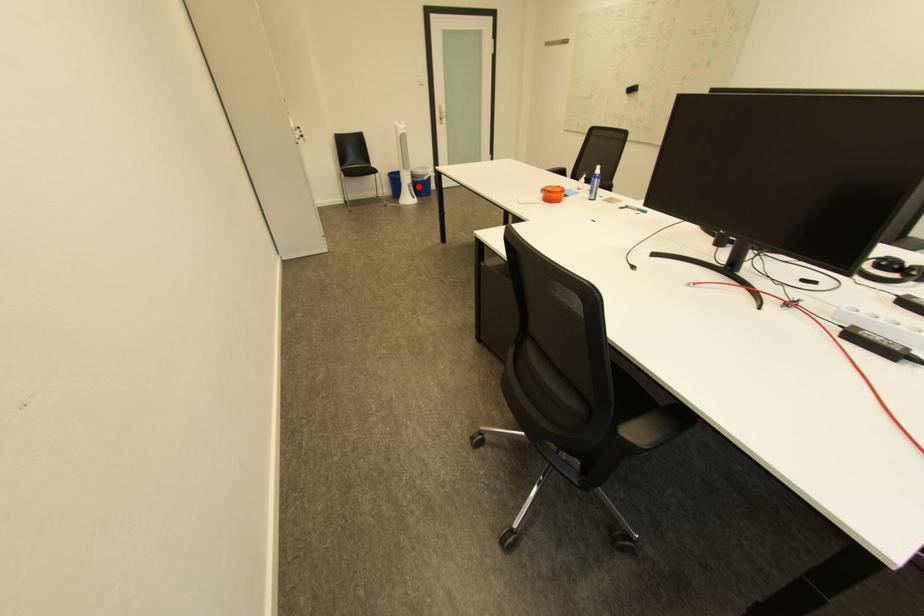
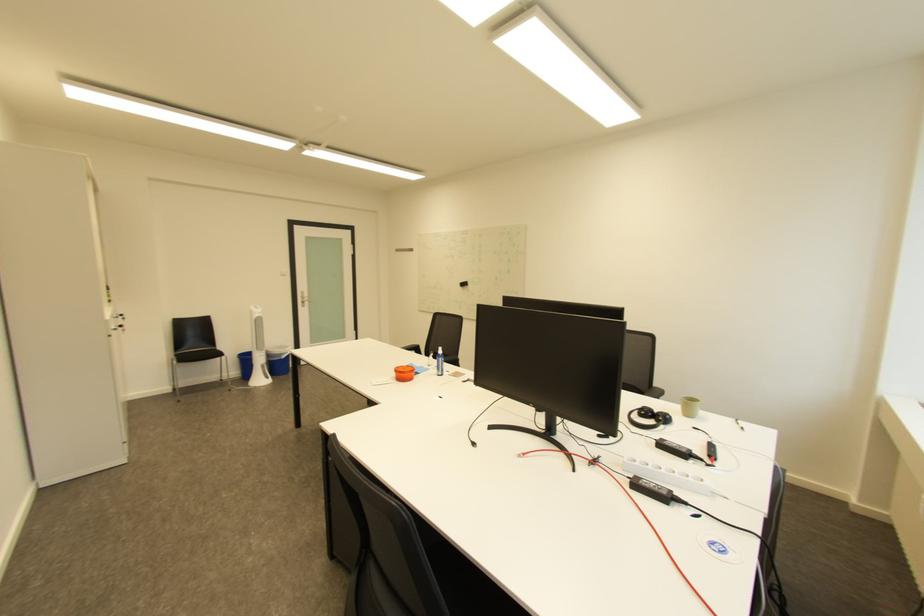
Question: I am providing you with two images of the same scene from different viewpoints. A red point is shown in image1. For the corresponding object point in image2, is it positioned nearer or farther from the camera?

Choices:
 (A) Nearer
 (B) Farther

Answer: (B)